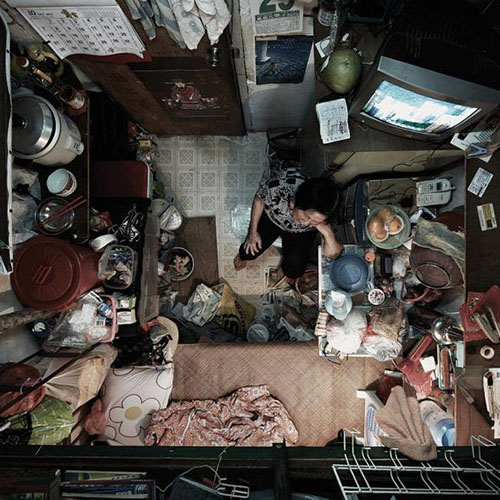
Help me find where you hang clothes in the image by pointing to them. Your answer should be formatted as a list of tuples, i.e. [(x1, y1), (x2, y2), ...], where each tuple contains the x and y coordinates of a point satisfying the conditions above.

[(349, 433), (368, 447), (394, 451), (449, 451), (480, 442)]